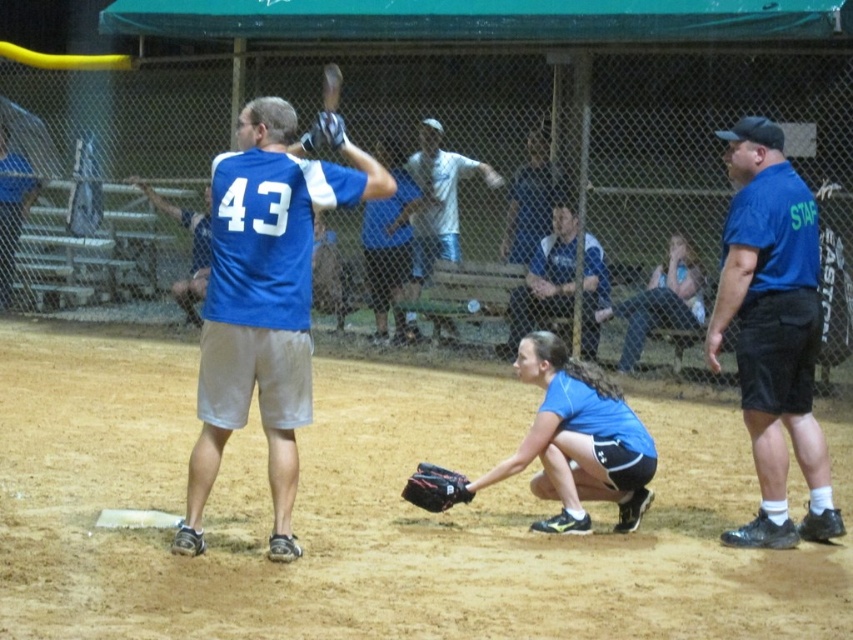
Question: Which object is the closest to the dark brown leather glove at lower center?

Choices:
 (A) blue jersey at center
 (B) blue matte baseball glove at center

Answer: (B)

Question: Is blue jersey at center further to camera compared to dark brown leather glove at lower center?

Choices:
 (A) no
 (B) yes

Answer: (B)

Question: Which of the following is the farthest from the observer?

Choices:
 (A) (428, 508)
 (B) (270, 387)
 (C) (548, 385)

Answer: (C)

Question: Based on their relative distances, which object is farther from the blue fabric shirt at right?

Choices:
 (A) blue matte baseball glove at center
 (B) blue fabric shirt at center

Answer: (B)

Question: Does blue fabric shirt at center appear on the left side of blue fabric shirt at right?

Choices:
 (A) yes
 (B) no

Answer: (A)

Question: Does blue fabric shirt at right have a greater width compared to dark brown leather glove at lower center?

Choices:
 (A) no
 (B) yes

Answer: (B)